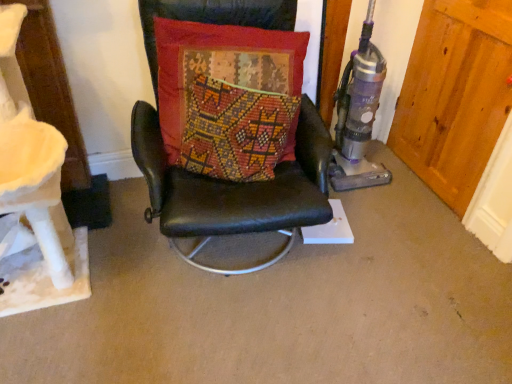
Identify the location of free location in front of black leather chair at center. The width and height of the screenshot is (512, 384). (237, 337).